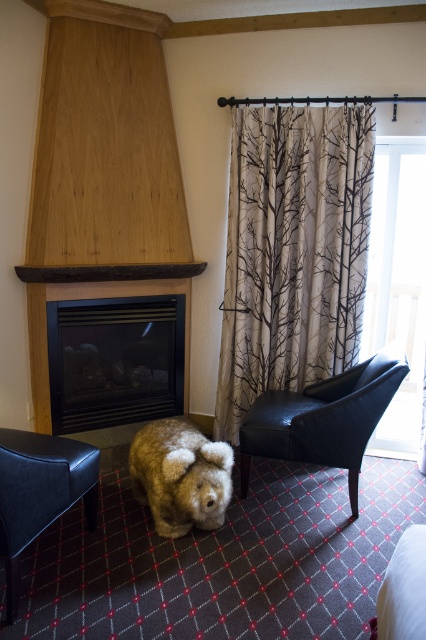
Question: Is beige fabric curtain with tree branches at center wider than black leather armchair at center-right?

Choices:
 (A) yes
 (B) no

Answer: (A)

Question: Considering the real-world distances, which object is farthest from the beige fabric curtain with tree branches at center?

Choices:
 (A) fuzzy brown stuffed animal at lower center
 (B) leather armchair at lower left
 (C) black leather armchair at center-right

Answer: (B)

Question: Is black glass fireplace at center positioned at the back of black leather armchair at center-right?

Choices:
 (A) yes
 (B) no

Answer: (A)

Question: Which of the following is the farthest from the observer?

Choices:
 (A) black glass fireplace at center
 (B) fuzzy brown stuffed animal at lower center

Answer: (A)

Question: Which point appears closest to the camera in this image?

Choices:
 (A) (34, 472)
 (B) (270, 115)
 (C) (157, 348)
 (D) (178, 467)

Answer: (A)

Question: Does beige fabric curtain with tree branches at center appear under black glass fireplace at center?

Choices:
 (A) no
 (B) yes

Answer: (A)